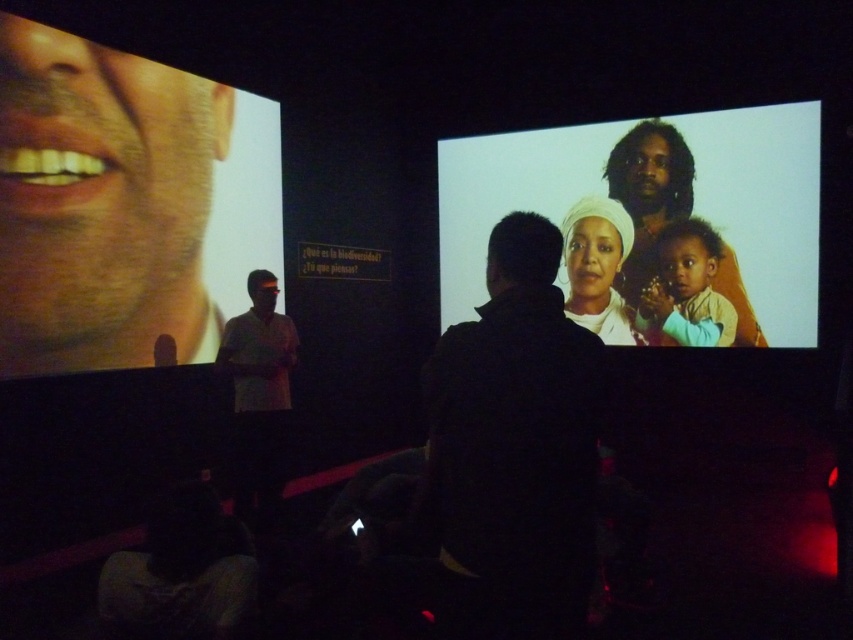
Question: Does black matte jacket at center have a lesser width compared to smooth skin woman at upper right?

Choices:
 (A) yes
 (B) no

Answer: (A)

Question: Which point is farther to the camera?

Choices:
 (A) (15, 173)
 (B) (589, 252)
 (C) (643, 173)

Answer: (B)

Question: Considering the relative positions of smooth skin woman at upper right and white matte headscarf at center in the image provided, where is smooth skin woman at upper right located with respect to white matte headscarf at center?

Choices:
 (A) above
 (B) below

Answer: (A)

Question: Which point is closer to the camera?

Choices:
 (A) [618, 316]
 (B) [560, 336]
 (C) [674, 176]

Answer: (B)

Question: Which object appears farthest from the camera in this image?

Choices:
 (A) black matte jacket at center
 (B) smooth skin face at left
 (C) white matte headscarf at center

Answer: (C)

Question: Does smooth skin face at left appear on the right side of white matte headscarf at center?

Choices:
 (A) no
 (B) yes

Answer: (A)